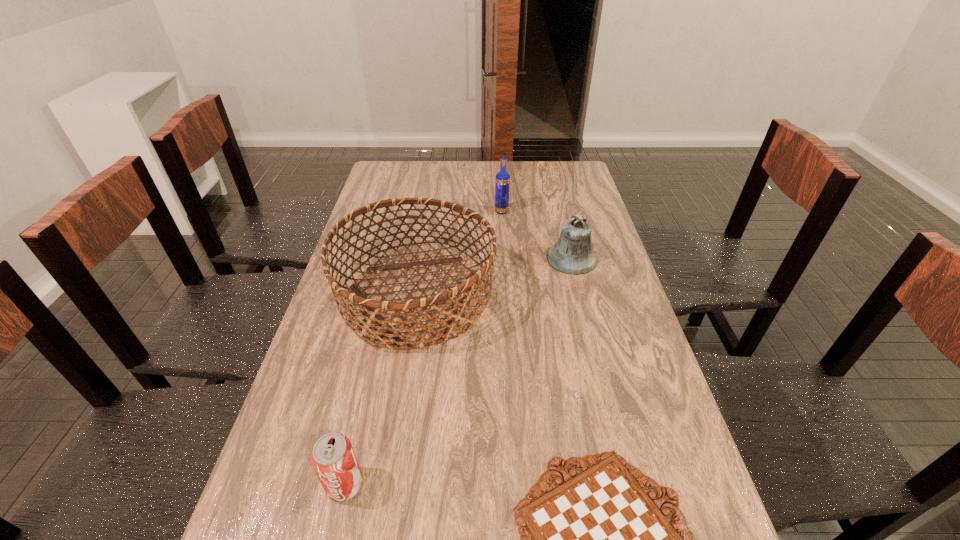
Locate an element on the screen. This screenshot has width=960, height=540. object that is the closest one to the chessboard is located at coordinates (376, 310).